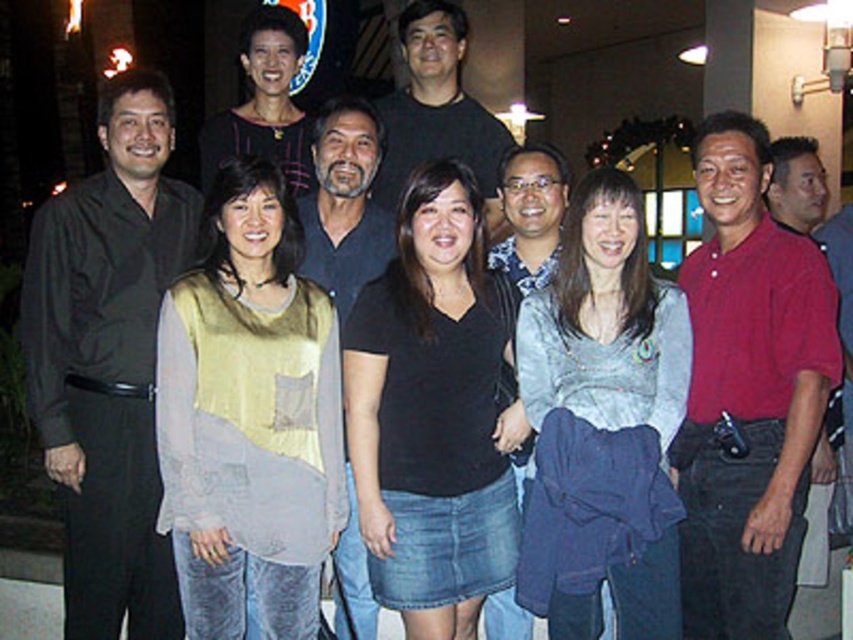
You are a photographer setting up for a group photo. You have two subjects wearing a black matte shirt at center and a blue patterned shirt at center. You need to adjust their positions so that they are exactly 1 meter apart. Based on the current scene, should you move them closer together or farther apart?

The current distance between the black matte shirt at center and blue patterned shirt at center is 1.12 meters. Since 1.12 meters is slightly more than 1 meter, you should move them closer together to achieve the desired distance.

You are a photographer who needs to adjust the focus of your camera. The minimum focus distance for your lens is 12 feet. If you want to focus on both the light gray cotton shirt at center and the matte black blouse at center, will you be able to do so without moving the camera?

The distance between the light gray cotton shirt at center and the matte black blouse at center is 11.90 feet. Since the minimum focus distance is 12 feet, the camera cannot focus on both objects simultaneously without moving the camera.

You are a photographer trying to adjust the lighting for a portrait. You notice two people in the front row wearing a light gray cotton shirt at center and a matte black blouse at center. Which clothing item is positioned lower on the person, potentially affecting the lighting setup?

The light gray cotton shirt at center is below the matte black blouse at center, so it is positioned lower and might require adjusting the lighting to account for its placement.